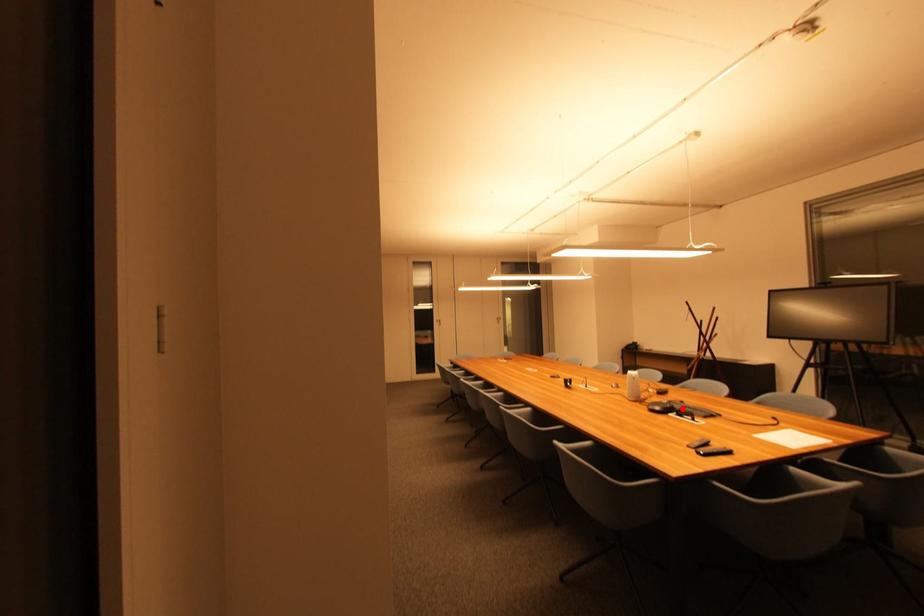
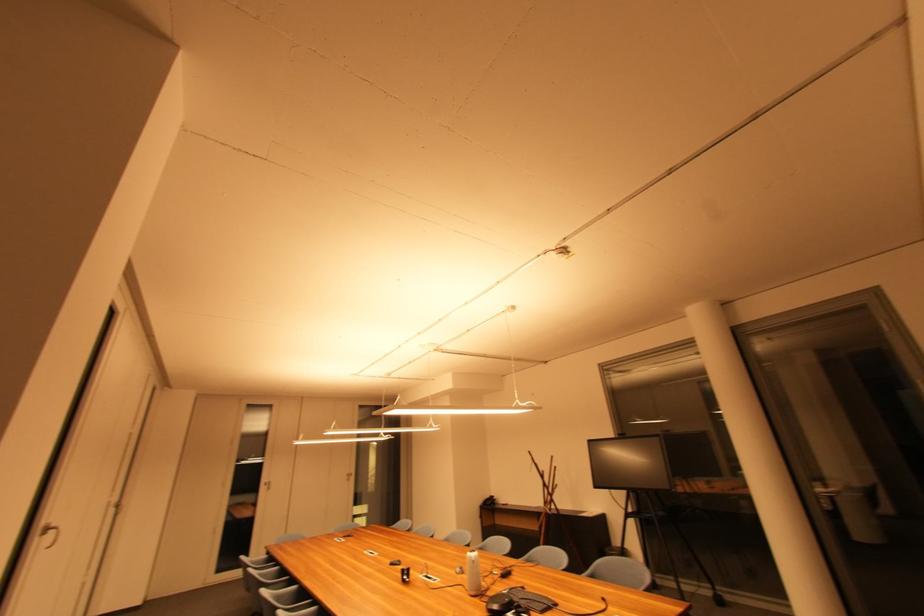
Question: I am providing you with two images of the same scene from different viewpoints. A red point is marked on the first image. Is the red point's position out of view in image 2?

Choices:
 (A) Yes
 (B) No

Answer: (B)